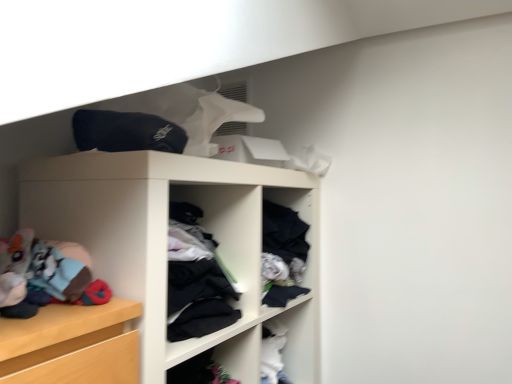
Describe the element at coordinates (126, 132) in the screenshot. This screenshot has height=384, width=512. I see `black matte cap at upper center` at that location.

You are a GUI agent. You are given a task and a screenshot of the screen. Output one action in this format:
    pyautogui.click(x=<x>, y=<y>)
    Task: Click on the black matte cap at upper center
    The height and width of the screenshot is (384, 512).
    Given the screenshot: What is the action you would take?
    pyautogui.click(x=126, y=132)

What do you see at coordinates (165, 243) in the screenshot? The image size is (512, 384). I see `white matte shelf at center` at bounding box center [165, 243].

The width and height of the screenshot is (512, 384). What are the coordinates of `white matte shelf at center` in the screenshot? It's located at (165, 243).

What is the approximate width of white matte shelf at center?

20.47 inches.

Find the location of a particular element. black matte cap at upper center is located at coordinates (126, 132).

Considering the positions of objects white matte shelf at center and black matte cap at upper center in the image provided, who is more to the left, white matte shelf at center or black matte cap at upper center?

black matte cap at upper center.

Is white matte shelf at center closer to the viewer compared to black matte cap at upper center?

Yes, white matte shelf at center is closer to the viewer.

Does point (200, 158) come closer to viewer compared to point (176, 146)?

No, it is not.

From the image's perspective, between white matte shelf at center and black matte cap at upper center, who is located below?

white matte shelf at center, from the image's perspective.

From a real-world perspective, which object rests below the other?

white matte shelf at center is physically lower.

Can you confirm if white matte shelf at center is wider than black matte cap at upper center?

Yes.

Considering the sizes of objects white matte shelf at center and black matte cap at upper center in the image provided, who is taller, white matte shelf at center or black matte cap at upper center?

white matte shelf at center.

Is white matte shelf at center smaller than black matte cap at upper center?

Actually, white matte shelf at center might be larger than black matte cap at upper center.

Is white matte shelf at center inside or outside of black matte cap at upper center?

white matte shelf at center is outside black matte cap at upper center.

Is white matte shelf at center beside black matte cap at upper center?

No, white matte shelf at center is not with black matte cap at upper center.

Is white matte shelf at center positioned with its back to black matte cap at upper center?

No, white matte shelf at center is not facing the opposite direction of black matte cap at upper center.

At what (x,y) coordinates should I click in order to perform the action: click on clothing behind the white matte shelf at center. Please return your answer as a coordinate pair (x, y). Looking at the image, I should click on (126, 132).

Consider the image. Can you confirm if black matte cap at upper center is positioned to the left of white matte shelf at center?

Indeed, black matte cap at upper center is positioned on the left side of white matte shelf at center.

Is black matte cap at upper center further to camera compared to white matte shelf at center?

Yes, black matte cap at upper center is further from the camera.

Which point is more forward, (104, 136) or (300, 372)?

The point (104, 136) is in front.

From the image's perspective, which object appears higher, black matte cap at upper center or white matte shelf at center?

black matte cap at upper center appears higher in the image.

From a real-world perspective, which is physically below, black matte cap at upper center or white matte shelf at center?

white matte shelf at center is physically lower.

Considering the relative sizes of black matte cap at upper center and white matte shelf at center in the image provided, is black matte cap at upper center thinner than white matte shelf at center?

Indeed, black matte cap at upper center has a lesser width compared to white matte shelf at center.

Considering the sizes of black matte cap at upper center and white matte shelf at center in the image, is black matte cap at upper center taller or shorter than white matte shelf at center?

Considering their sizes, black matte cap at upper center has less height than white matte shelf at center.

Is black matte cap at upper center smaller than white matte shelf at center?

Indeed, black matte cap at upper center has a smaller size compared to white matte shelf at center.

Is black matte cap at upper center spatially inside white matte shelf at center, or outside of it?

The correct answer is: outside.

Is black matte cap at upper center positioned far away from white matte shelf at center?

black matte cap at upper center is actually quite close to white matte shelf at center.

Does black matte cap at upper center turn towards white matte shelf at center?

No.

Can you tell me how much black matte cap at upper center and white matte shelf at center differ in facing direction?

The angle between the facing direction of black matte cap at upper center and the facing direction of white matte shelf at center is 1.44 degrees.

What are the coordinates of `clothing lying on the left of white matte shelf at center` in the screenshot? It's located at (126, 132).

Where is `shelf that is in front of the black matte cap at upper center`? Image resolution: width=512 pixels, height=384 pixels. shelf that is in front of the black matte cap at upper center is located at coordinates (165, 243).

Find the location of a particular element. Image resolution: width=512 pixels, height=384 pixels. clothing that is above the white matte shelf at center (from a real-world perspective) is located at coordinates click(x=126, y=132).